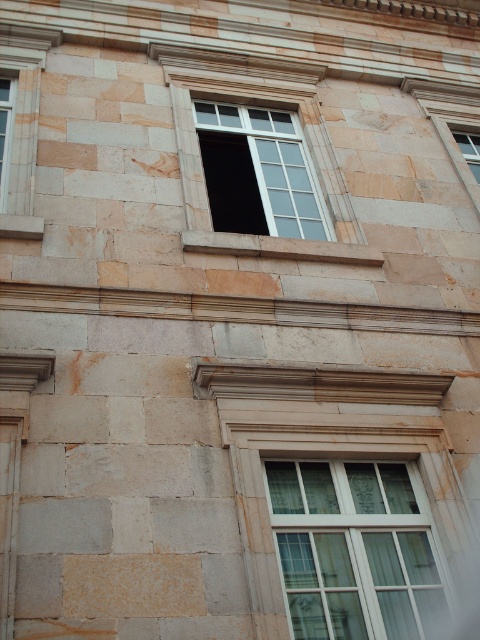
Does transparent glass window at upper center have a smaller size compared to clear glass window at upper right?

Incorrect, transparent glass window at upper center is not smaller in size than clear glass window at upper right.

Who is more forward, (273, 220) or (465, 150)?

Point (273, 220)

This screenshot has height=640, width=480. What do you see at coordinates (266, 168) in the screenshot?
I see `transparent glass window at upper center` at bounding box center [266, 168].

Locate an element on the screen. The width and height of the screenshot is (480, 640). transparent glass window at upper center is located at coordinates (266, 168).

Consider the image. Between clear glass window at center and transparent glass window at upper center, which one has more height?

transparent glass window at upper center

Is clear glass window at center further to camera compared to transparent glass window at upper center?

No, clear glass window at center is closer to the viewer.

Is point (403, 509) farther from viewer compared to point (284, 225)?

No, it is not.

This screenshot has width=480, height=640. Find the location of `clear glass window at center`. clear glass window at center is located at coordinates pos(356,548).

Is point (359, 579) more distant than point (467, 163)?

No, (359, 579) is closer to viewer.

Find the location of a particular element. Image resolution: width=480 pixels, height=640 pixels. clear glass window at center is located at coordinates (356, 548).

Is point (296, 518) positioned before point (474, 140)?

Yes, it is.

Identify the location of clear glass window at center. (356, 548).